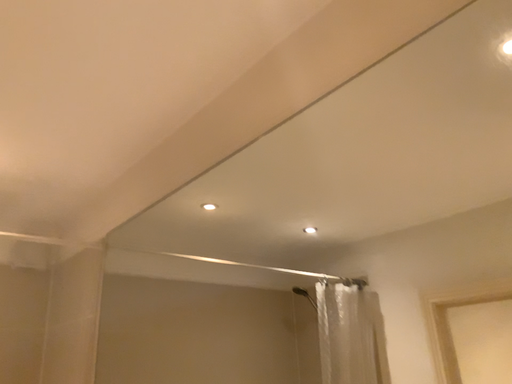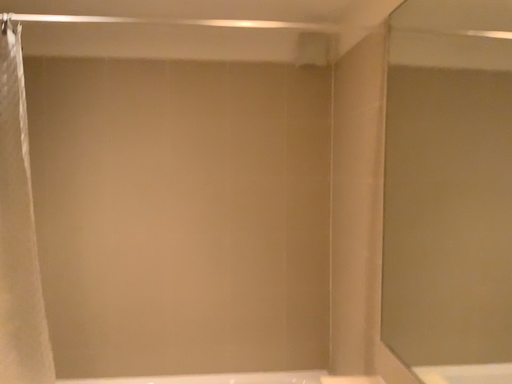
Question: Which way did the camera rotate in the video?

Choices:
 (A) rotated right
 (B) rotated left

Answer: (B)